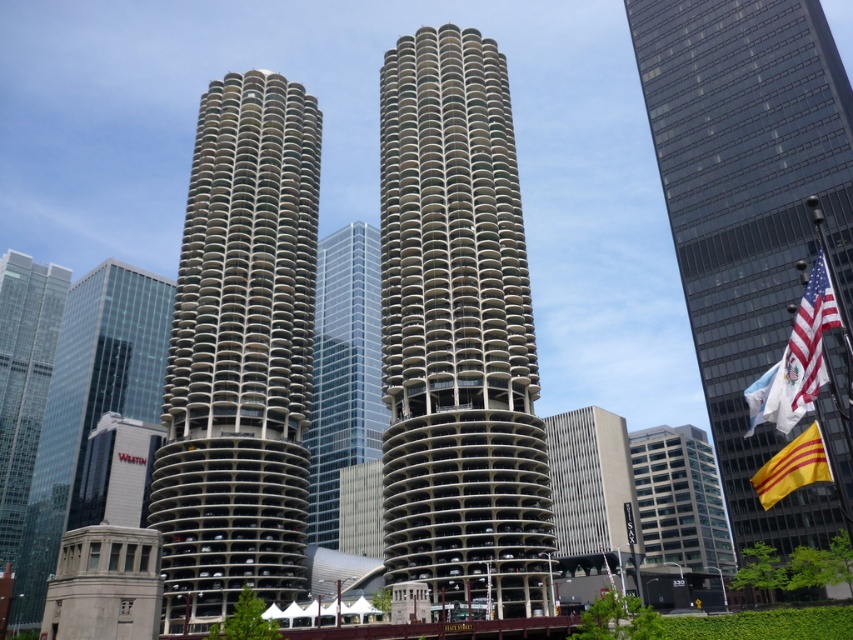
You are a city planner analyzing the skyline. You need to determine which of the two buildings, the glassy reflective building at left or the glassy steel skyscraper at center, has a larger footprint. Based on the scene, can you make this determination?

The glassy reflective building at left might be wider than glassy steel skyscraper at center, so it likely has a larger footprint.